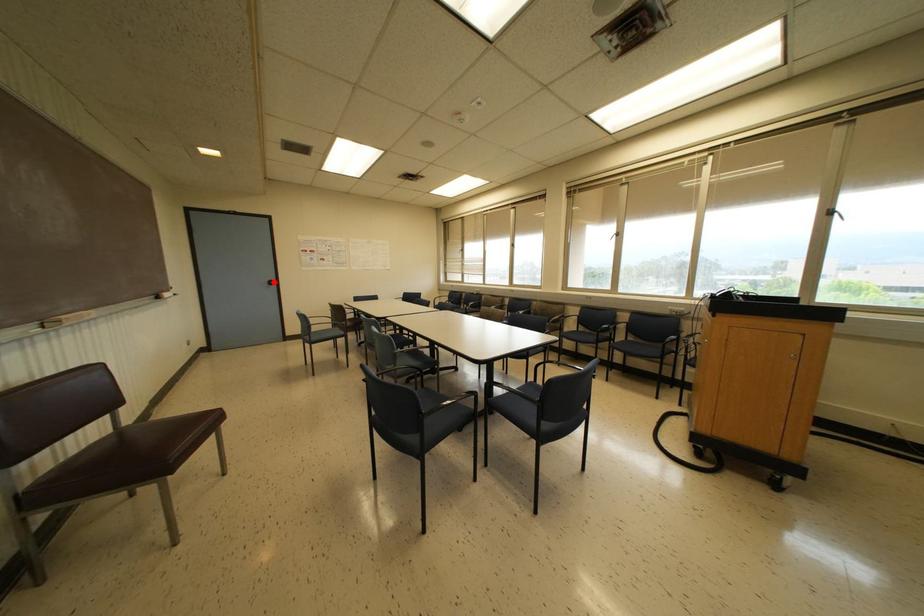
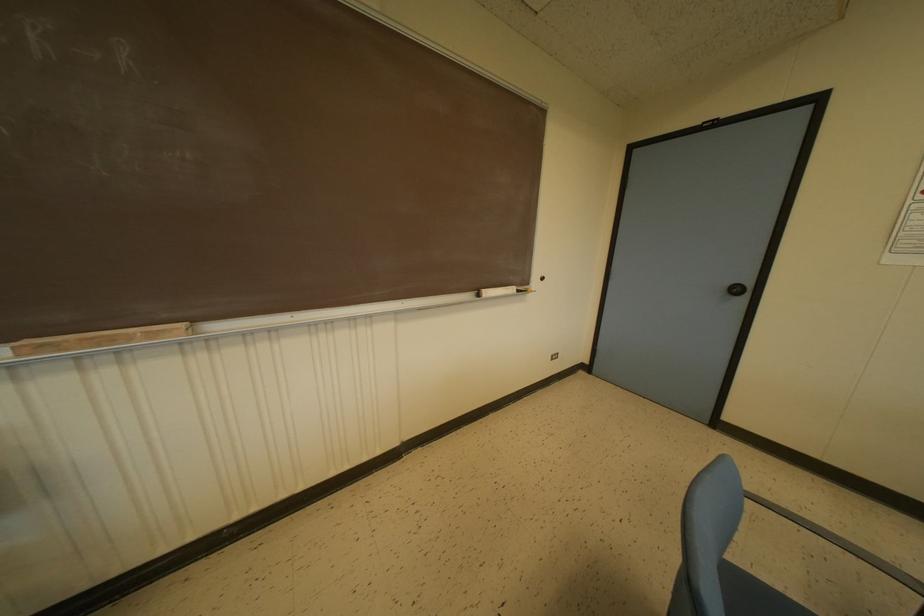
Question: A red point is marked in image1. In image2, is the corresponding 3D point closer to the camera or farther? Reply with the corresponding letter.

Choices:
 (A) The corresponding 3D point is closer.
 (B) The corresponding 3D point is farther.

Answer: (A)